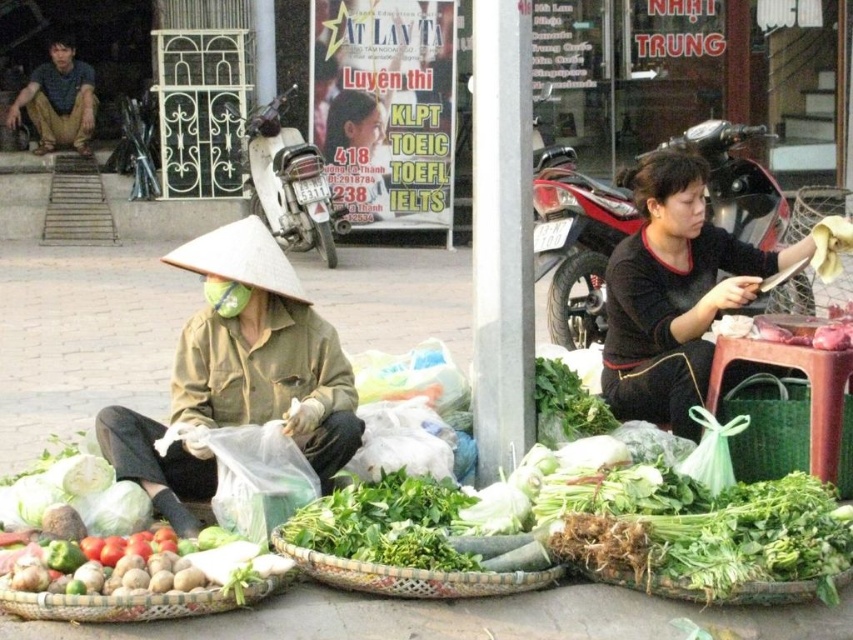
Is point (793, 461) farther from camera compared to point (839, 189)?

No, it is in front of (839, 189).

Who is more forward, (x=757, y=456) or (x=808, y=291)?

Point (x=757, y=456) is more forward.

Describe the element at coordinates (769, 426) in the screenshot. I see `green woven basket at lower right` at that location.

Where is `green woven basket at lower right`? This screenshot has width=853, height=640. green woven basket at lower right is located at coordinates (769, 426).

Who is more forward, (x=622, y=172) or (x=817, y=195)?

Positioned in front is point (x=622, y=172).

In the scene shown: Can you confirm if black matte shirt at center is positioned above green woven basket at right?

No.

Which is in front, point (639, 388) or point (822, 284)?

Point (639, 388)

Image resolution: width=853 pixels, height=640 pixels. What are the coordinates of `black matte shirt at center` in the screenshot? It's located at (672, 292).

Between black matte shirt at center and matte brown shirt at upper left, which one has less height?

With less height is black matte shirt at center.

Measure the distance from black matte shirt at center to matte brown shirt at upper left.

black matte shirt at center and matte brown shirt at upper left are 10.96 meters apart from each other.

What do you see at coordinates (672, 292) in the screenshot?
I see `black matte shirt at center` at bounding box center [672, 292].

This screenshot has width=853, height=640. Find the location of `black matte shirt at center`. black matte shirt at center is located at coordinates (672, 292).